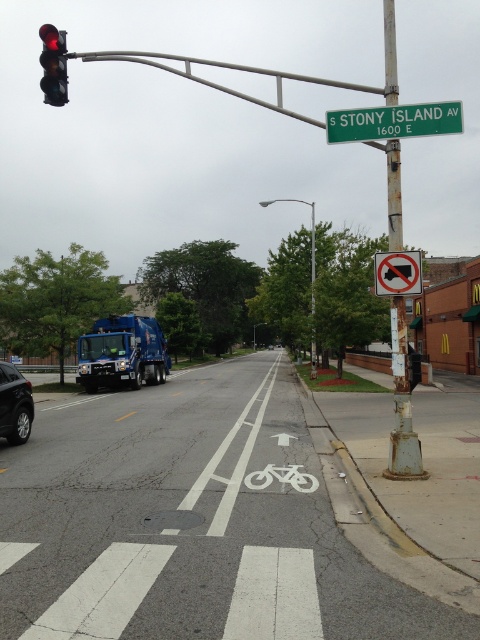
You are a cyclist planning to ride through the white painted bicycle lane at center. There is a silver metallic sedan at left parked nearby. Can you safely ride through the bicycle lane without the car obstructing your path?

The white painted bicycle lane at center has a width larger than the silver metallic sedan at left, so you can safely ride through the bicycle lane without the car obstructing your path.

You are standing at the point with coordinates point (420,256) and want to walk to the point with coordinates point (357,112). Which direction should you face to move towards your destination?

A: You should face north because point (357,112) is behind point (420,256), meaning it is in the northern direction.

In the scene shown: You are a driver approaching the intersection and see the silver metallic sedan at left and the white plastic no left turn at upper center. Which object appears larger in the image?

The white plastic no left turn at upper center is larger than the silver metallic sedan at left.